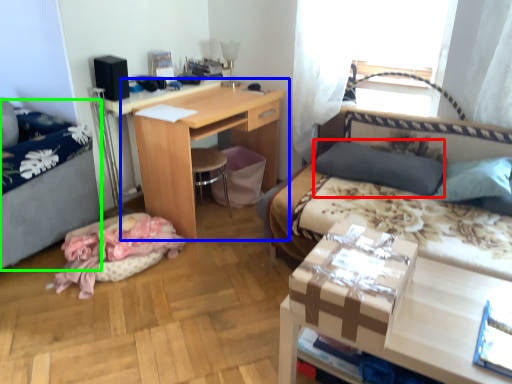
Question: Which is nearer to the pillow (highlighted by a red box)? table (highlighted by a blue box) or hospital bed (highlighted by a green box).

Choices:
 (A) table
 (B) hospital bed

Answer: (A)